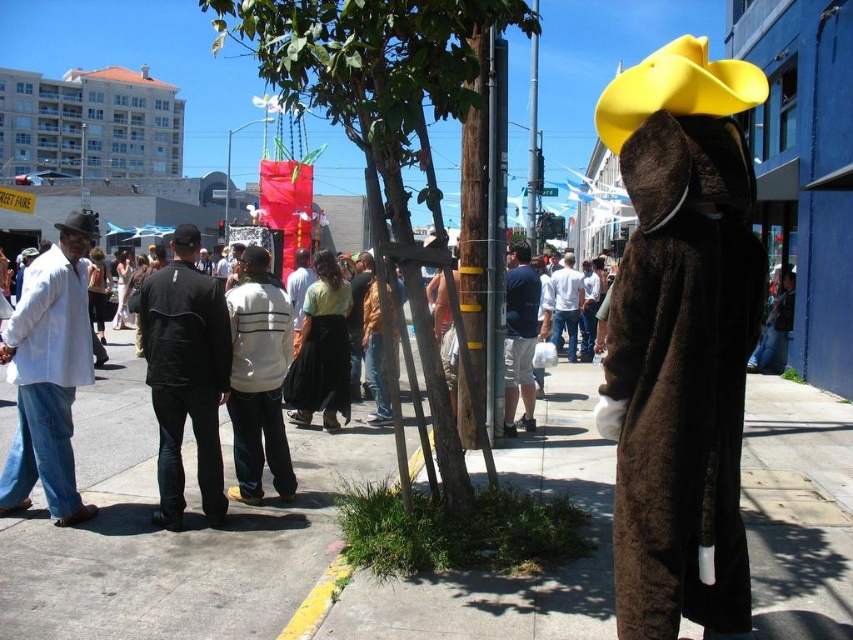
You are a photographer trying to capture a photo of the white cotton shirt at center and the matte black cowboy hat at left. Since you want to ensure both items are clearly visible in the frame, which object should you focus on first considering their sizes?

The white cotton shirt at center has a lesser width compared to matte black cowboy hat at left, so you should focus on the matte black cowboy hat at left first since it is larger and might require more precise framing.

You are a photographer standing in the middle of the street. You want to take a photo that includes both the white striped sweater at center and the yellow matte cowboy hat at upper right. What is the minimum distance you need to move forward or backward to ensure both objects are in the frame?

The white striped sweater at center and the yellow matte cowboy hat at upper right are 3.06 meters apart. To include both in the frame, you need to move far enough back so that the distance between them fits within your camera lens field of view. The exact distance depends on your lens, but generally, increasing distance reduces the apparent separation between objects in the frame.